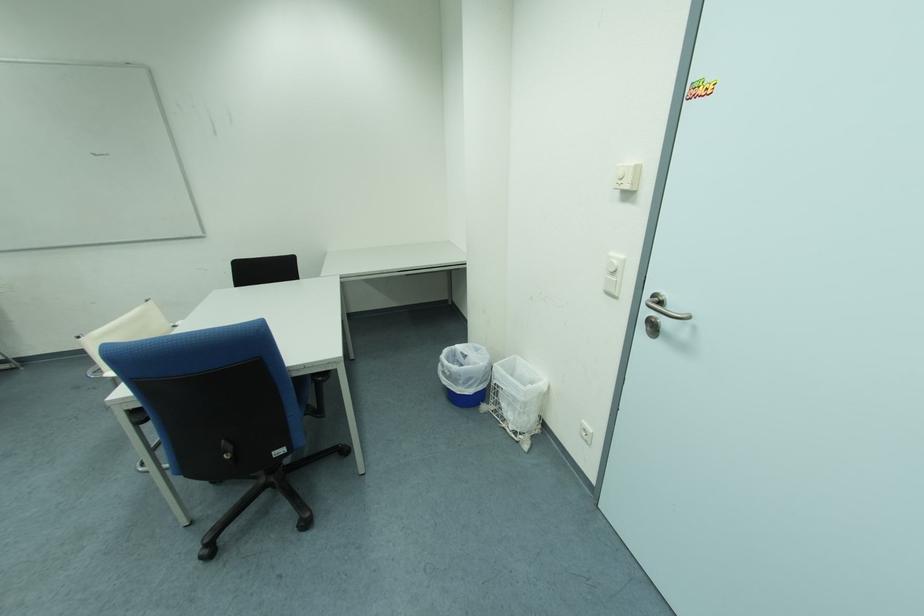
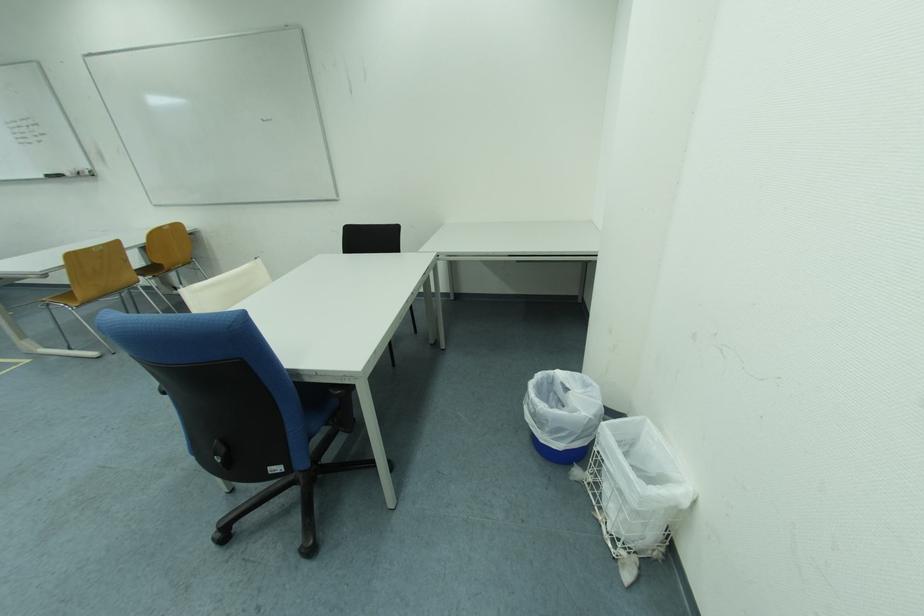
Question: How did the camera likely rotate?

Choices:
 (A) Left
 (B) Right
 (C) Up
 (D) Down

Answer: (A)